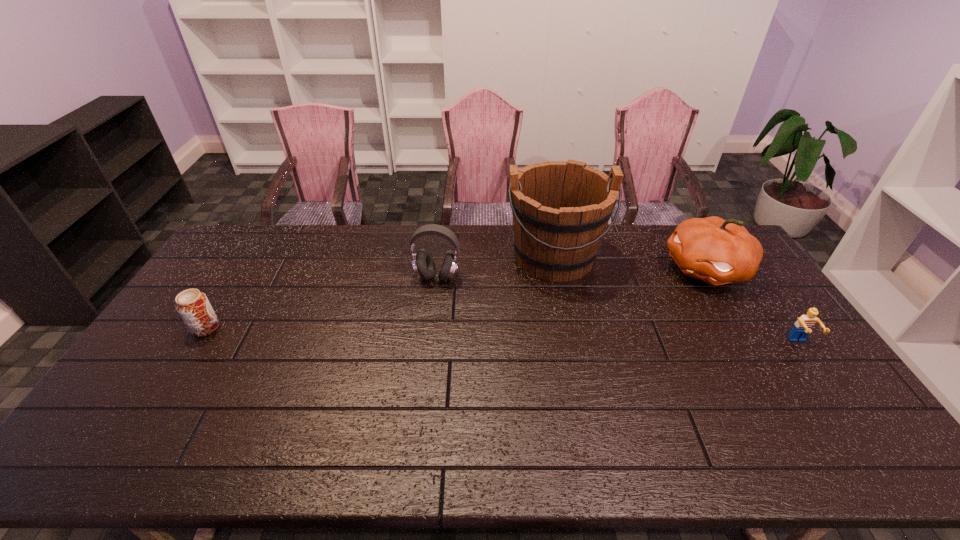
Locate an element on the screen. the leftmost object is located at coordinates (192, 305).

Where is `Lego`? This screenshot has width=960, height=540. Lego is located at coordinates (804, 325).

I want to click on the third object from left to right, so click(x=561, y=209).

Find the location of `wine bucket`. wine bucket is located at coordinates (561, 209).

Identify the location of pumpkin. The height and width of the screenshot is (540, 960). (716, 251).

The height and width of the screenshot is (540, 960). Identify the location of headset. (423, 263).

Identify the location of vacant area situated 0.220m on the back of the beer can. (241, 272).

You are a GUI agent. You are given a task and a screenshot of the screen. Output one action in this format:
    pyautogui.click(x=<x>, y=<y>)
    Task: Click on the vacant space located on the face of the Lego
    
    Given the screenshot: What is the action you would take?
    pyautogui.click(x=852, y=416)

Locate an element on the screen. free space located on the side of the wine bucket with the handle for carrying is located at coordinates (577, 389).

Identify the location of free space located 0.330m on the side of the wine bucket with the handle for carrying. (573, 368).